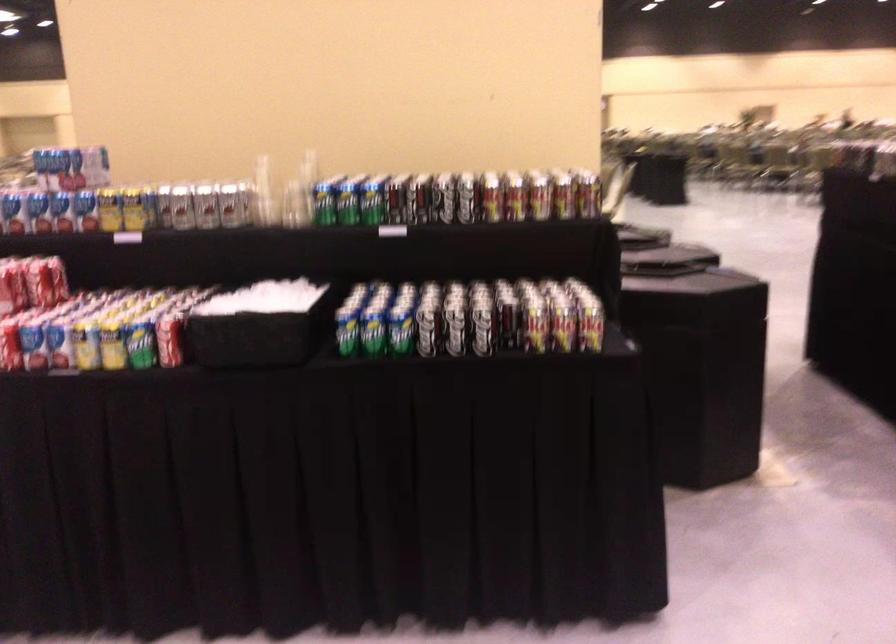
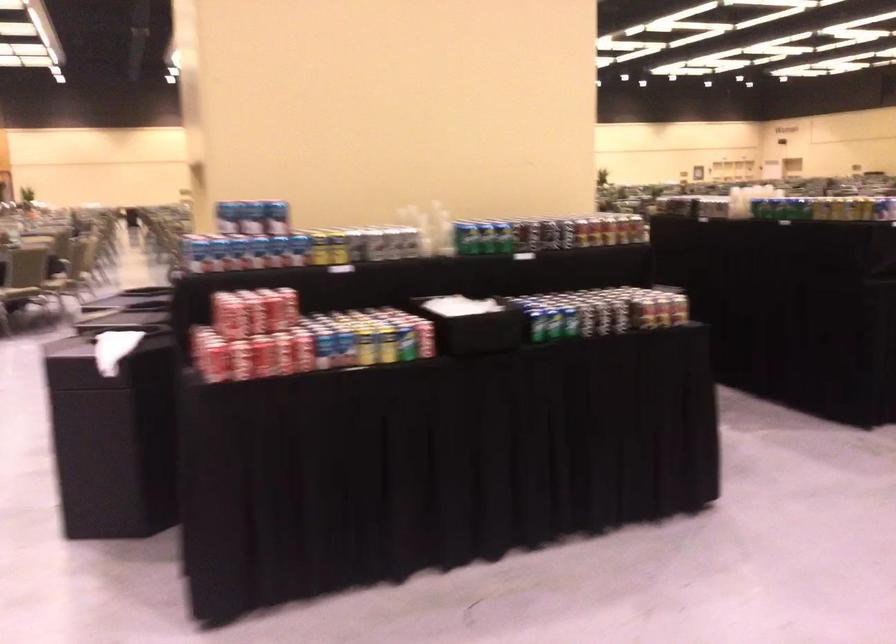
Find the pixel in the second image that matches pixel 401 202 in the first image.

(530, 234)